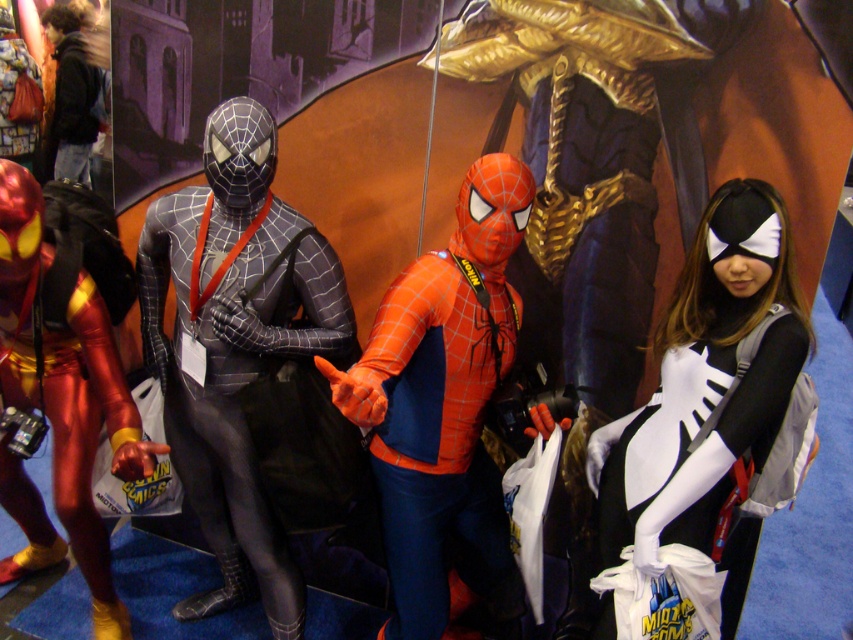
You are at the convention and want to take a photo of both the white matte spider suit at right and the matte black jacket at upper left. Which one should you focus on first to ensure both are in focus?

You should focus on the matte black jacket at upper left first because it is farther away from the viewer compared to the white matte spider suit at right, ensuring both are in focus.

You are standing at the entrance of the convention hall and want to take a photo of the point at coordinates (778,369). Is this point within your camera lens range of 2 meters?

The distance of point (778,369) from camera is 1.63 meters, which is within the camera lens range of 2 meters. Yes, you can take the photo.